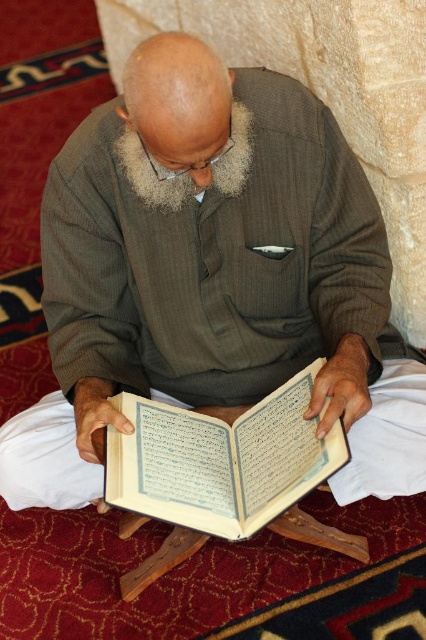
Question: Which point appears farthest from the camera in this image?

Choices:
 (A) (169, 228)
 (B) (261, 433)
 (C) (239, 113)

Answer: (A)

Question: Which object is positioned closest to the white paper book at center?

Choices:
 (A) brown textured sweater at center
 (B) white fluffy beard at center

Answer: (A)

Question: Considering the relative positions of white paper book at center and white fluffy beard at center in the image provided, where is white paper book at center located with respect to white fluffy beard at center?

Choices:
 (A) left
 (B) right

Answer: (B)

Question: Is white paper book at center to the right of white fluffy beard at center from the viewer's perspective?

Choices:
 (A) yes
 (B) no

Answer: (A)

Question: Does brown textured sweater at center have a greater width compared to white paper book at center?

Choices:
 (A) yes
 (B) no

Answer: (A)

Question: Which object is positioned closest to the white fluffy beard at center?

Choices:
 (A) white paper book at center
 (B) brown textured sweater at center

Answer: (B)